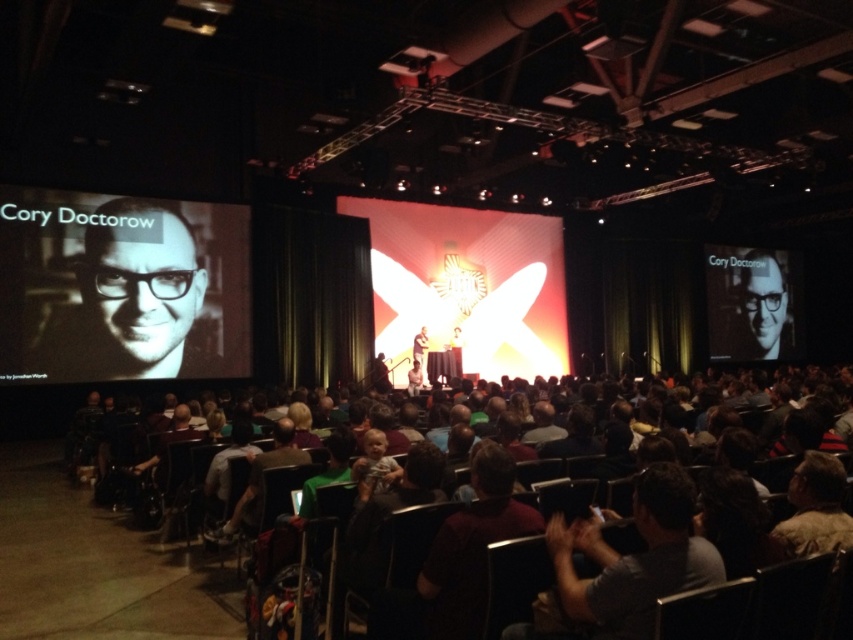
Question: Can you confirm if matte black screen at left is positioned to the right of matte black glasses at upper right?

Choices:
 (A) no
 (B) yes

Answer: (A)

Question: In this image, where is matte black glasses at upper right located relative to matte black laptop at center?

Choices:
 (A) right
 (B) left

Answer: (A)

Question: Among these points, which one is farthest from the camera?

Choices:
 (A) (1, 241)
 (B) (724, 636)

Answer: (A)

Question: Considering the real-world distances, which object is closest to the matte black glasses at upper right?

Choices:
 (A) matte black laptop at center
 (B) matte black screen at left
 (C) dark brown leather chairs at lower center

Answer: (A)

Question: Which of the following is the closest to the observer?

Choices:
 (A) (750, 259)
 (B) (704, 589)
 (C) (416, 346)

Answer: (B)

Question: Does matte black screen at left have a larger size compared to matte black laptop at center?

Choices:
 (A) yes
 (B) no

Answer: (A)